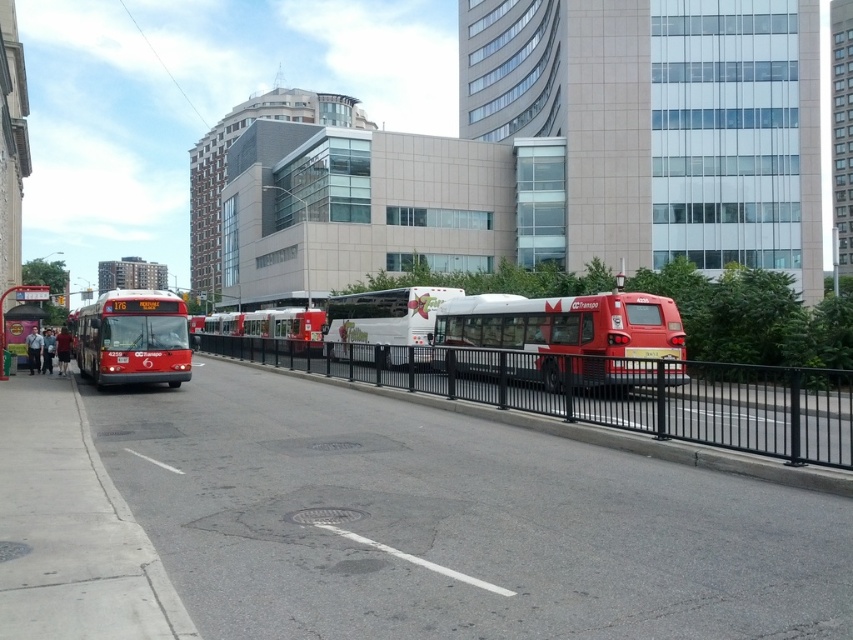
You are standing at the point marked as point (627,394). What object is located exactly at this point?

The black metal fence at center is located exactly at point (627,394).

You are a delivery driver who needs to park your truck between the matte red bus at left and the white painted line at lower center. Based on the scene description, can your truck fit in that space?

The matte red bus at left is larger in size than the white painted line at lower center, but the exact dimensions of the space between them are not provided. Without knowing the truck size or the available space, it is impossible to determine if it will fit.

You are a pedestrian standing on the sidewalk and want to cross the street to reach the buses. There is a matte red bus at left and a white painted line at lower center. Which object should you look for before stepping onto the road?

You should look for the white painted line at lower center before stepping onto the road because the matte red bus at left is positioned to the left of it, indicating the road boundary.